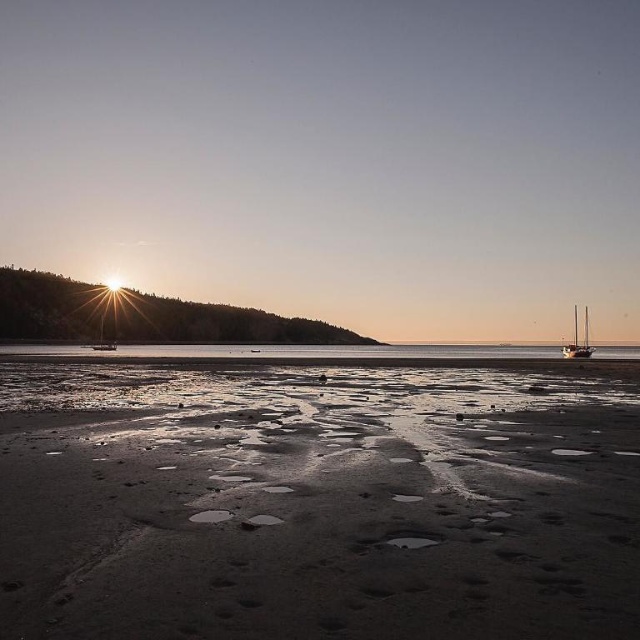
Is damp sand at center wider than wooden sailboat at right?

No, damp sand at center is not wider than wooden sailboat at right.

Can you confirm if damp sand at center is taller than wooden sailboat at right?

In fact, damp sand at center may be shorter than wooden sailboat at right.

Is point (49, 522) behind point (573, 305)?

No, (49, 522) is in front of (573, 305).

Where is `damp sand at center`? Image resolution: width=640 pixels, height=640 pixels. damp sand at center is located at coordinates (317, 502).